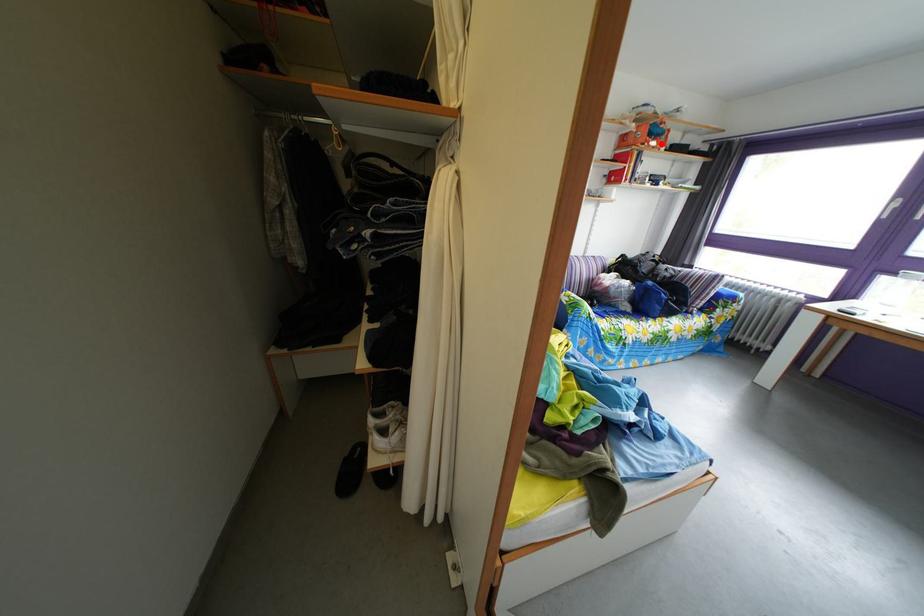
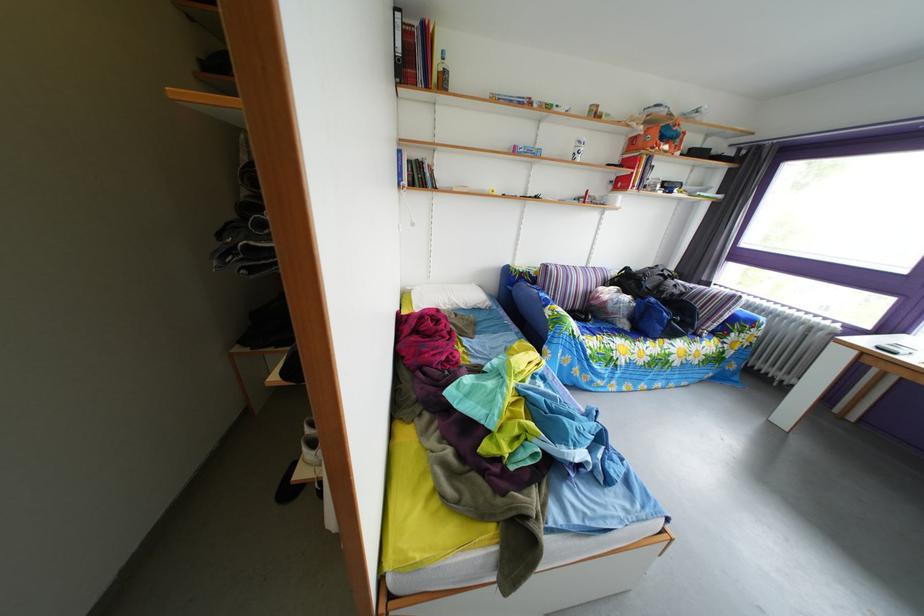
The point at the highlighted location is marked in the first image. Where is the corresponding point in the second image?

(673, 147)